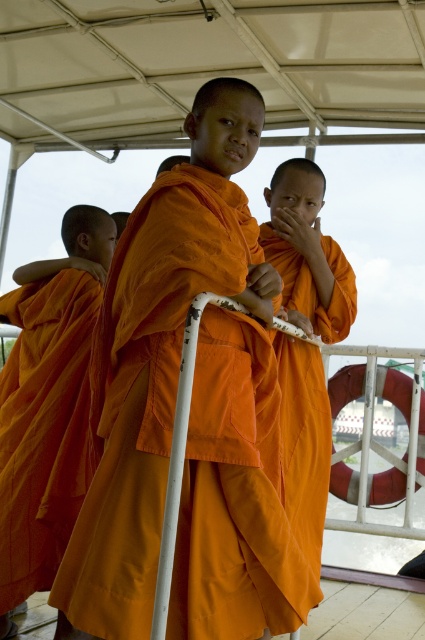
You are standing on the deck of the boat and want to walk from the point at coordinates point (229, 385) to the point at coordinates point (291, 426). Which direction should you move relative to the boat?

You should move backward relative to the boat because point (229, 385) is in front of point (291, 426).

You are a photographer trying to capture a group photo of the orange clothed monk at center and the orange cloth at center. You want to ensure both subjects are fully visible in the frame. Which subject requires a wider angle to accommodate its size?

The orange cloth at center requires a wider angle because its width is larger than the orange clothed monk at center.

You are a tailor observing the orange cloth robe at center and the orange clothed monk at center. Which one has a shorter length?

The orange cloth robe at center is shorter than the orange clothed monk at center.